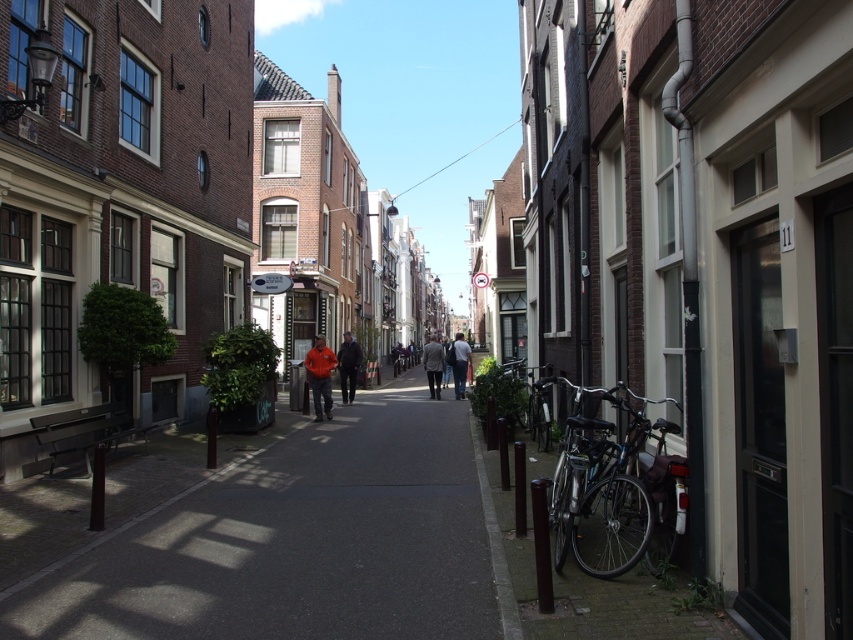
You are a delivery person who needs to determine which coat to wear for a quick trip. Both the light gray wool coat at center and the orange jacket at center are available. Based on their sizes, which one would be more suitable if you prefer a taller garment for better visibility?

The orange jacket at center is taller than the light gray wool coat at center, making it more suitable for better visibility due to its greater height.